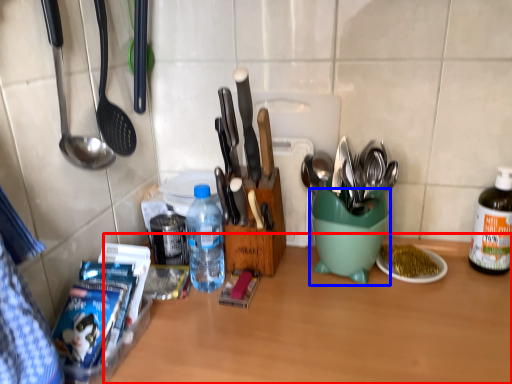
Question: Which of the following is the farthest to the observer, table (highlighted by a red box) or mixing bowl (highlighted by a blue box)?

Choices:
 (A) table
 (B) mixing bowl

Answer: (B)